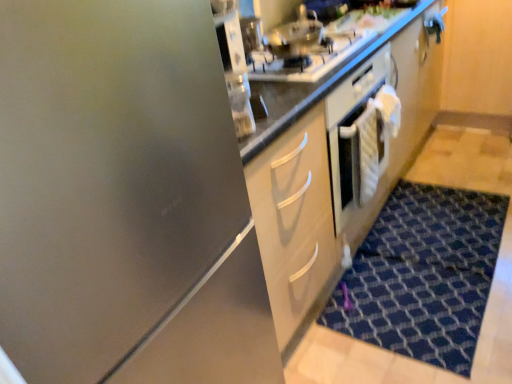
Question: From the image's perspective, is stainless steel at upper center positioned above or below blue textured rug at lower right?

Choices:
 (A) below
 (B) above

Answer: (B)

Question: Is stainless steel at upper center situated inside blue textured rug at lower right or outside?

Choices:
 (A) outside
 (B) inside

Answer: (A)

Question: Estimate the real-world distances between objects in this image. Which object is closer to the blue textured rug at lower right?

Choices:
 (A) stainless steel at upper center
 (B) stainless steel gas stove at upper center

Answer: (B)

Question: Estimate the real-world distances between objects in this image. Which object is closer to the stainless steel at upper center?

Choices:
 (A) stainless steel gas stove at upper center
 (B) blue textured rug at lower right

Answer: (A)